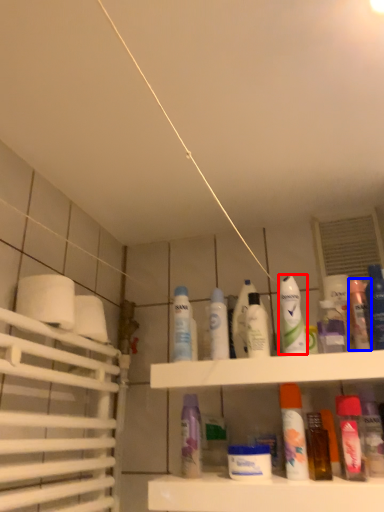
Question: Which object appears farthest to the camera in this image, mouthwash (highlighted by a red box) or mouthwash (highlighted by a blue box)?

Choices:
 (A) mouthwash
 (B) mouthwash

Answer: (B)